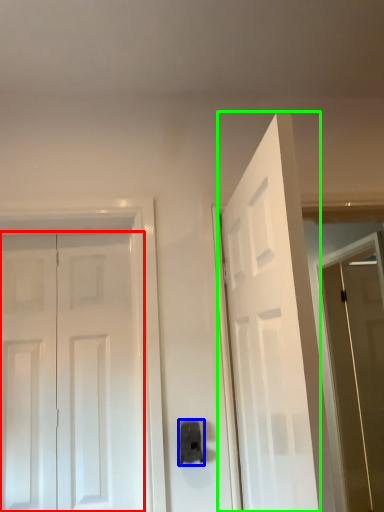
Question: Estimate the real-world distances between objects in this image. Which object is farther from door (highlighted by a red box), door handle (highlighted by a blue box) or door (highlighted by a green box)?

Choices:
 (A) door handle
 (B) door

Answer: (B)